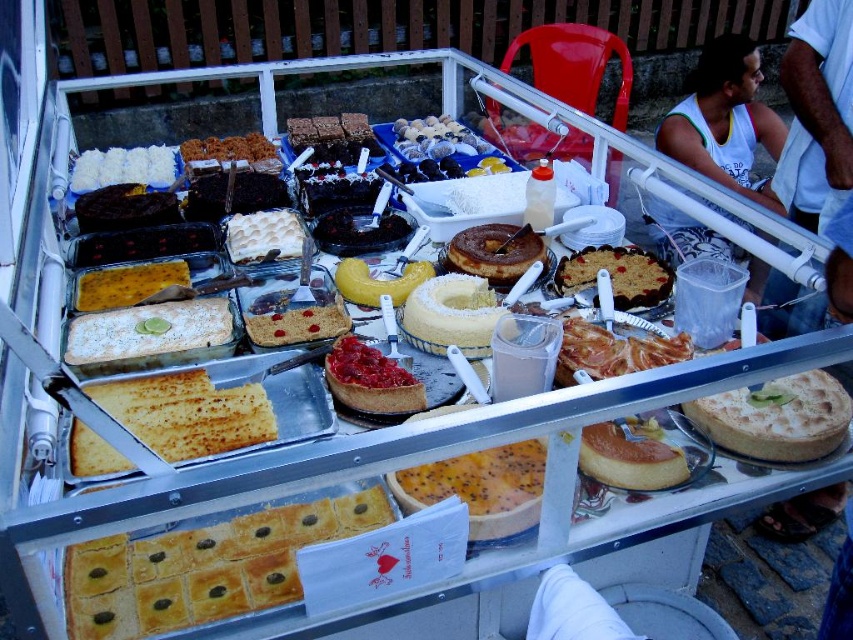
Question: Which of the following is the farthest from the observer?

Choices:
 (A) white tank top at upper right
 (B) yellow custard at center
 (C) dark chocolate cake at center
 (D) white sugared cake at center

Answer: (A)

Question: Can you confirm if golden crumbly cake at center is positioned below dark chocolate cake at center?

Choices:
 (A) no
 (B) yes

Answer: (B)

Question: Which point appears farthest from the camera in this image?

Choices:
 (A) (590, 424)
 (B) (492, 264)
 (C) (380, 388)

Answer: (B)

Question: Can you confirm if white sugared cake at center is wider than golden crumbly cake at center?

Choices:
 (A) yes
 (B) no

Answer: (B)

Question: Does golden crumbly tart at center have a larger size compared to white fluffy cake at center?

Choices:
 (A) no
 (B) yes

Answer: (A)

Question: Which of the following is the farthest from the observer?

Choices:
 (A) white sugared cake at center
 (B) cherry-topped cake at center

Answer: (A)